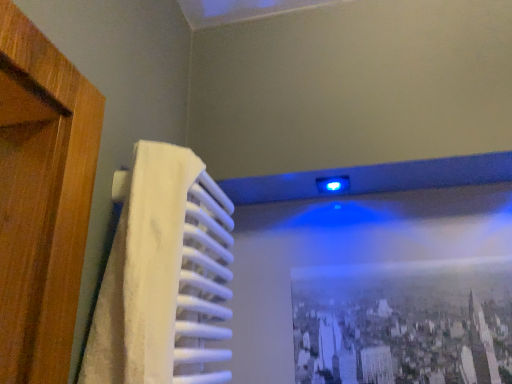
This screenshot has width=512, height=384. I want to click on white fluffy bath towel at left, so click(x=164, y=276).

The height and width of the screenshot is (384, 512). Describe the element at coordinates (164, 276) in the screenshot. I see `white fluffy bath towel at left` at that location.

At what (x,y) coordinates should I click in order to perform the action: click on white fluffy bath towel at left. Please return your answer as a coordinate pair (x, y). The height and width of the screenshot is (384, 512). Looking at the image, I should click on (164, 276).